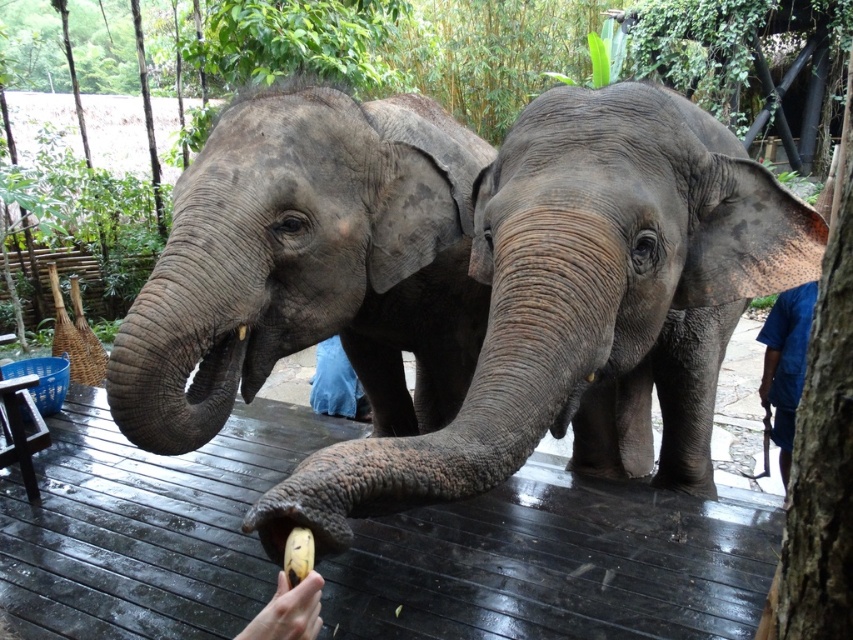
Question: Which is nearer to the yellow matte banana at lower center?

Choices:
 (A) blue fabric shirt at right
 (B) smooth skin hand at lower center
 (C) dark brown wooden deck at center

Answer: (B)

Question: Does dark brown wooden deck at center lie behind blue denim pants at center?

Choices:
 (A) yes
 (B) no

Answer: (B)

Question: Which is farther from the blue fabric shirt at right?

Choices:
 (A) smooth skin hand at lower center
 (B) dark brown wooden deck at center

Answer: (A)

Question: Can you confirm if blue denim pants at center is positioned below yellow matte banana at lower center?

Choices:
 (A) yes
 (B) no

Answer: (A)

Question: Can you confirm if smooth skin hand at lower center is bigger than blue denim pants at center?

Choices:
 (A) no
 (B) yes

Answer: (A)

Question: Among these objects, which one is farthest from the camera?

Choices:
 (A) dark brown wooden deck at center
 (B) smooth skin hand at lower center

Answer: (A)